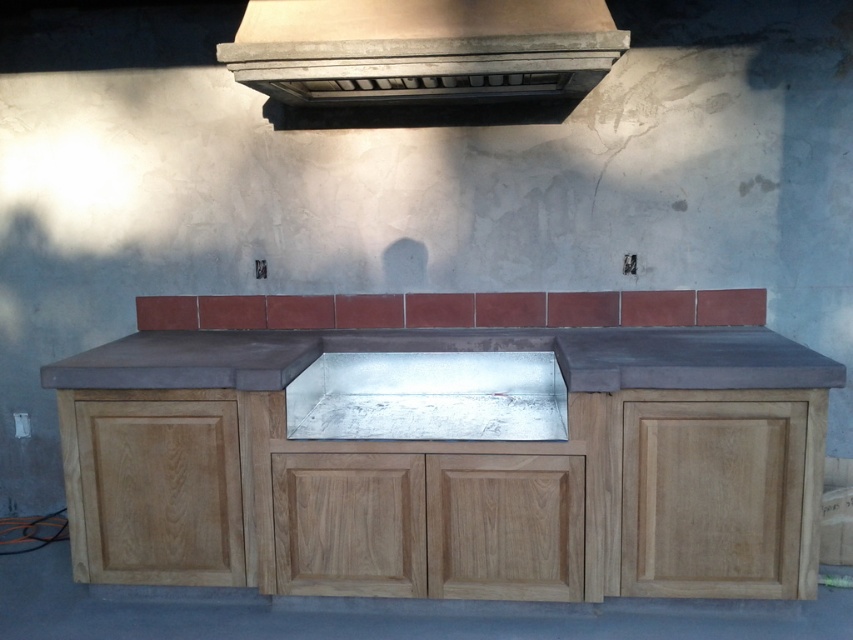
Who is positioned more to the left, concrete textured vent at upper center or gray concrete counter at center?

From the viewer's perspective, gray concrete counter at center appears more on the left side.

Does concrete textured vent at upper center have a greater width compared to gray concrete counter at center?

No.

This screenshot has height=640, width=853. Describe the element at coordinates (422, 51) in the screenshot. I see `concrete textured vent at upper center` at that location.

Locate an element on the screen. concrete textured vent at upper center is located at coordinates (422, 51).

Locate an element on the screen. This screenshot has width=853, height=640. concrete textured vent at upper center is located at coordinates (422, 51).

Which is in front, point (457, 61) or point (490, 403)?

Point (457, 61)

Who is more distant from viewer, (624, 33) or (328, 356)?

The point (328, 356) is behind.

The width and height of the screenshot is (853, 640). What are the coordinates of `concrete textured vent at upper center` in the screenshot? It's located at (422, 51).

I want to click on concrete countertop at center, so click(x=451, y=468).